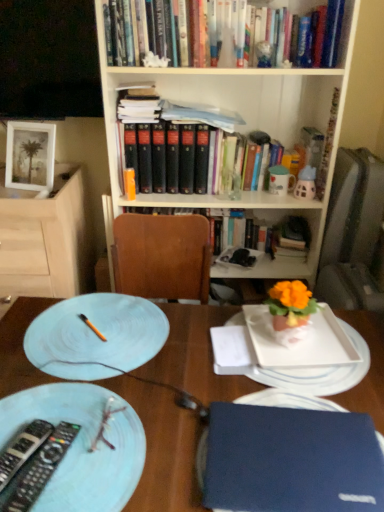
In order to click on blank area to the left of blue hardcover book at lower right in this screenshot , I will do `click(149, 439)`.